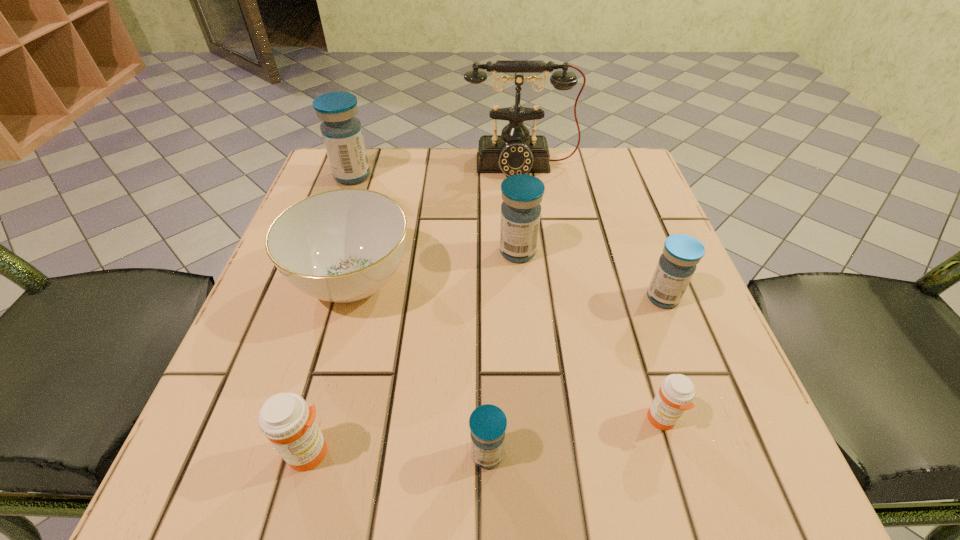
Locate an element on the screen. The width and height of the screenshot is (960, 540). empty space that is in between the bigger orange medicine and the gray chinaware is located at coordinates (331, 367).

Find the location of a particular element. This screenshot has height=540, width=960. vacant area that lies between the smallest blue medicine and the chinaware is located at coordinates (420, 368).

At what (x,y) coordinates should I click in order to perform the action: click on object that is the closest to the second tallest object. Please return your answer as a coordinate pair (x, y). Looking at the image, I should click on (343, 245).

Point out which object is positioned as the fifth nearest to the telephone. Please provide its 2D coordinates. Your answer should be formatted as a tuple, i.e. [(x, y)], where the tuple contains the x and y coordinates of a point satisfying the conditions above.

[(676, 393)]

What are the coordinates of `the third closest medicine relative to the right orange medicine` in the screenshot? It's located at (522, 194).

Find the location of a particular element. Image resolution: width=960 pixels, height=540 pixels. the third closest medicine relative to the second nearest blue medicine is located at coordinates [x=488, y=423].

Locate which blue medicine is the fourth closest to the smaller orange medicine. Please provide its 2D coordinates. Your answer should be formatted as a tuple, i.e. [(x, y)], where the tuple contains the x and y coordinates of a point satisfying the conditions above.

[(342, 134)]

What are the coordinates of `blue medicine that is the closest one to the chinaware` in the screenshot? It's located at (522, 194).

Find the location of `free spot that satisfies the following two spatial constraints: 1. on the dial of the black telephone; 2. on the left side of the third farthest medicine`. free spot that satisfies the following two spatial constraints: 1. on the dial of the black telephone; 2. on the left side of the third farthest medicine is located at coordinates (538, 298).

At what (x,y) coordinates should I click in order to perform the action: click on free space that satisfies the following two spatial constraints: 1. on the front side of the gray chinaware; 2. on the right side of the second tallest object. Please return your answer as a coordinate pair (x, y). This screenshot has width=960, height=540. Looking at the image, I should click on (315, 281).